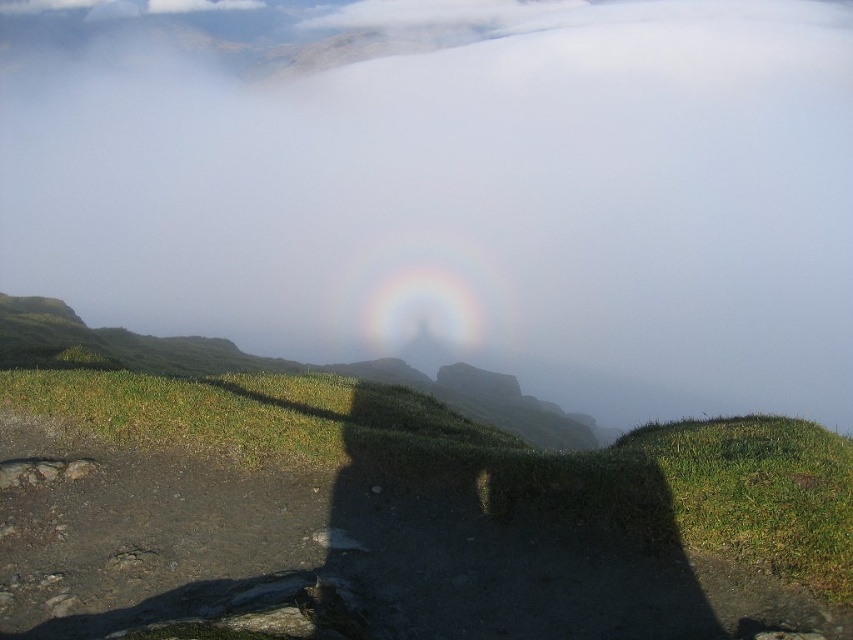
You are a hiker trying to navigate through the misty landscape. You see the transparent mist at center and the green grassy hill at lower right. Which object is higher in elevation?

The transparent mist at center is located above the green grassy hill at lower right, so it has a higher elevation.